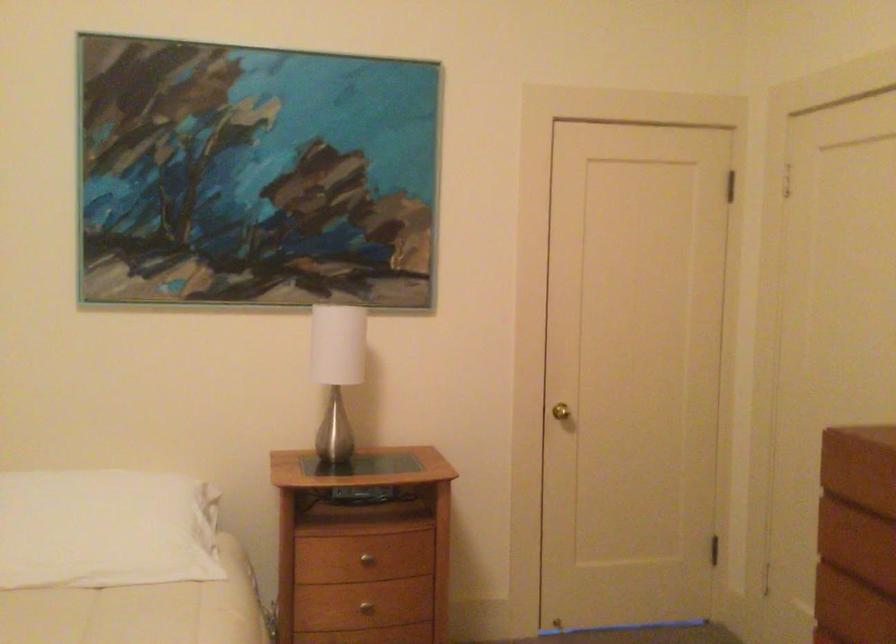
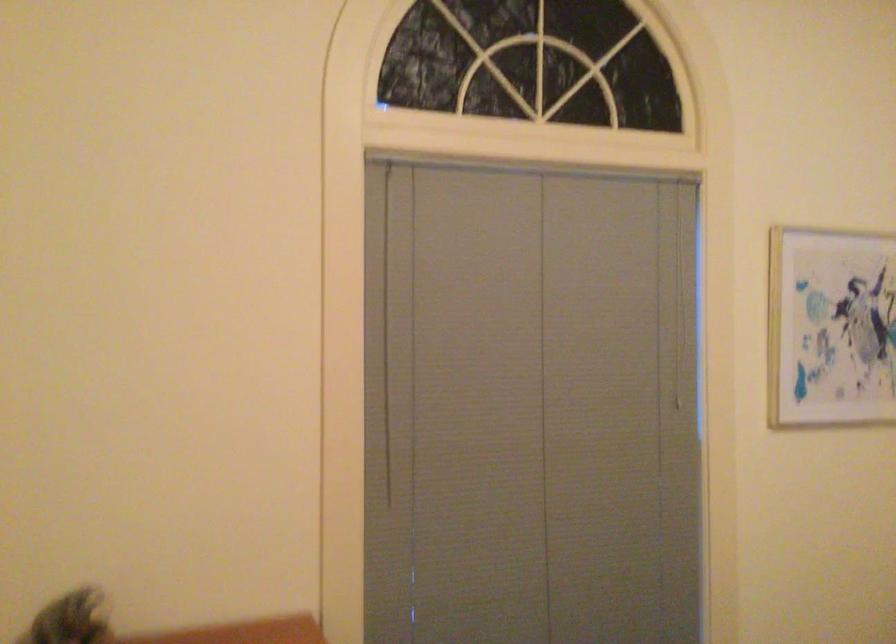
Question: The first image is from the beginning of the video and the second image is from the end. How did the camera likely rotate when shooting the video?

Choices:
 (A) Left
 (B) Right
 (C) Up
 (D) Down

Answer: (A)